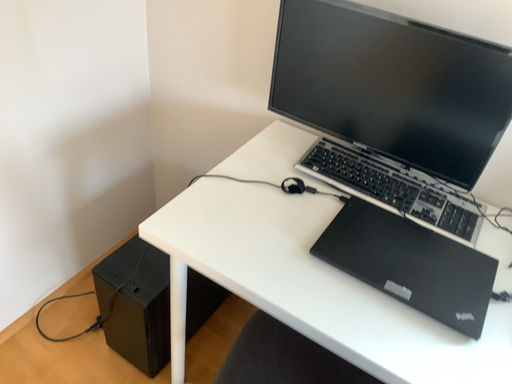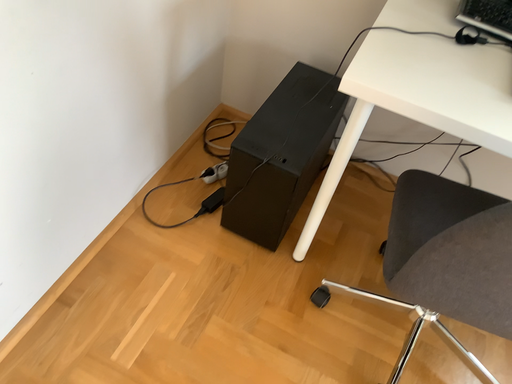
Question: How did the camera likely rotate when shooting the video?

Choices:
 (A) rotated left
 (B) rotated right

Answer: (B)